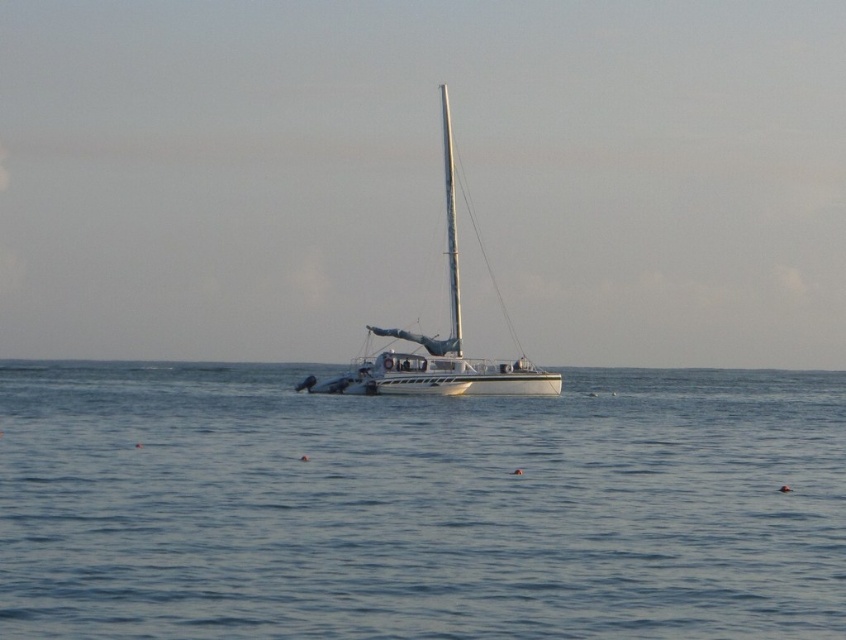
You are a sailor on the deck of the sailboat and want to retrieve an item that fell into the water. Which object is closer to you, the blue water at center or the white matte mast at center?

The white matte mast at center is closer to you because it is above the blue water at center, which is located below it.

You are standing on the deck of the sailboat and looking at two points marked on the water surface. The first point is at coordinates point (452, 298) and the second point is at point (453, 202). Which point is closer to you?

Point (452, 298) is closer to the viewer than point (453, 202).